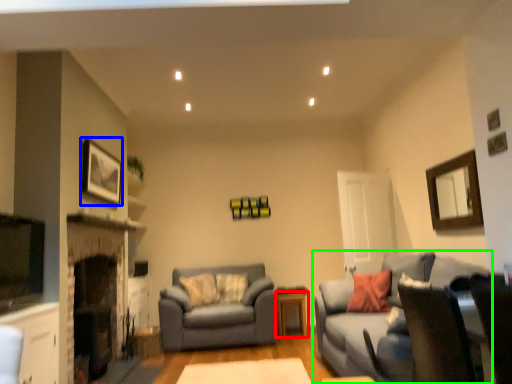
Question: Based on their relative distances, which object is farther from table (highlighted by a red box)? Choose from picture frame (highlighted by a blue box) and studio couch (highlighted by a green box).

Choices:
 (A) picture frame
 (B) studio couch

Answer: (A)